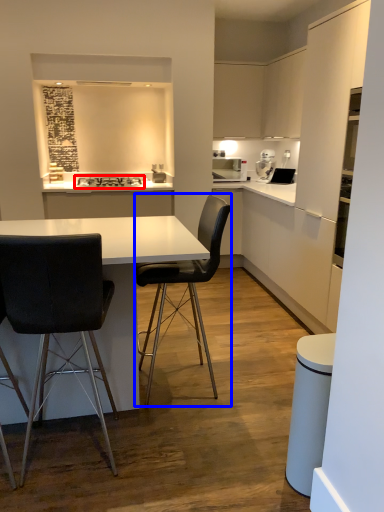
Question: Which of the following is the closest to the observer, stove (highlighted by a red box) or chair (highlighted by a blue box)?

Choices:
 (A) stove
 (B) chair

Answer: (B)